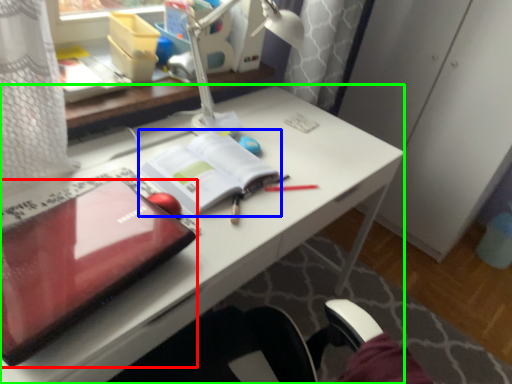
Question: Considering the real-world distances, which object is closest to laptop (highlighted by a red box)? paperback book (highlighted by a blue box) or desk (highlighted by a green box).

Choices:
 (A) paperback book
 (B) desk

Answer: (B)